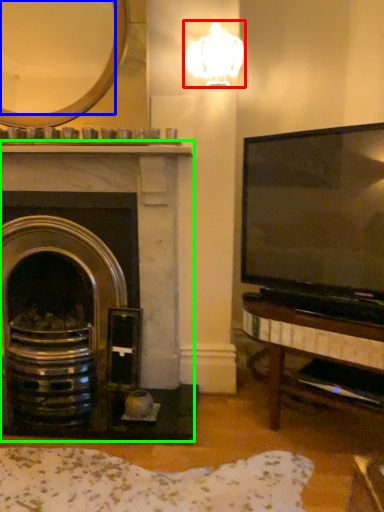
Question: Estimate the real-world distances between objects in this image. Which object is farther from lamp (highlighted by a red box), mirror (highlighted by a blue box) or fireplace (highlighted by a green box)?

Choices:
 (A) mirror
 (B) fireplace

Answer: (B)